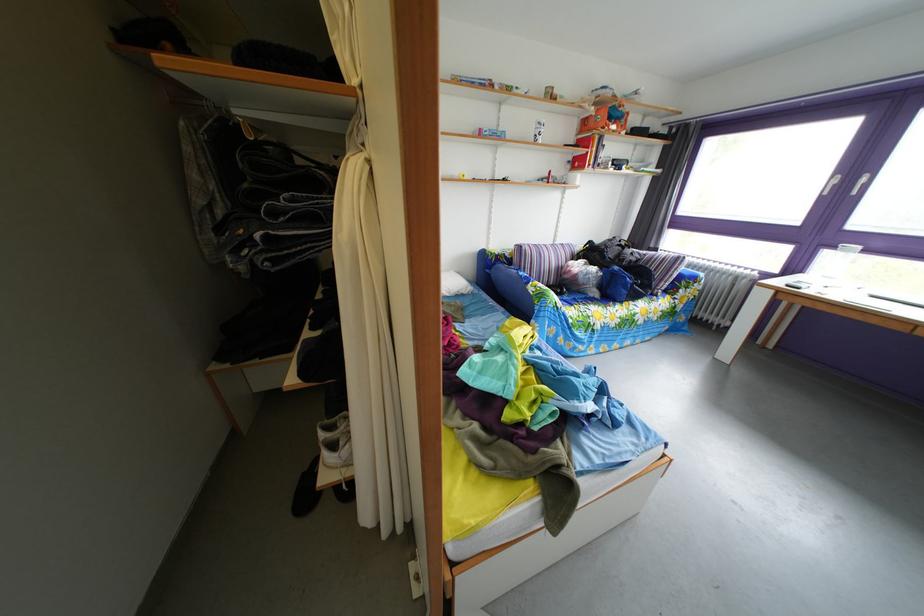
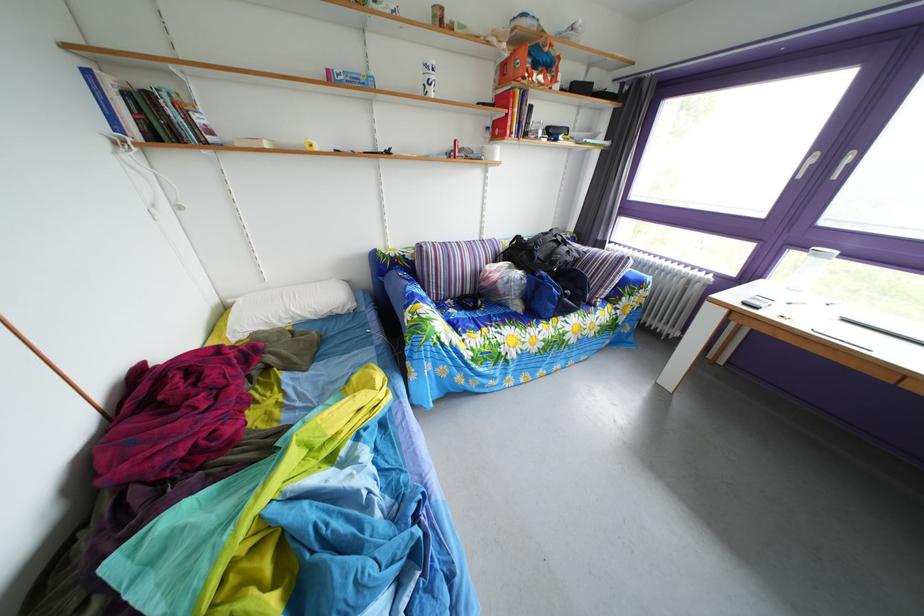
Where in the second image is the point corresponding to [492,138] from the first image?

(339, 79)